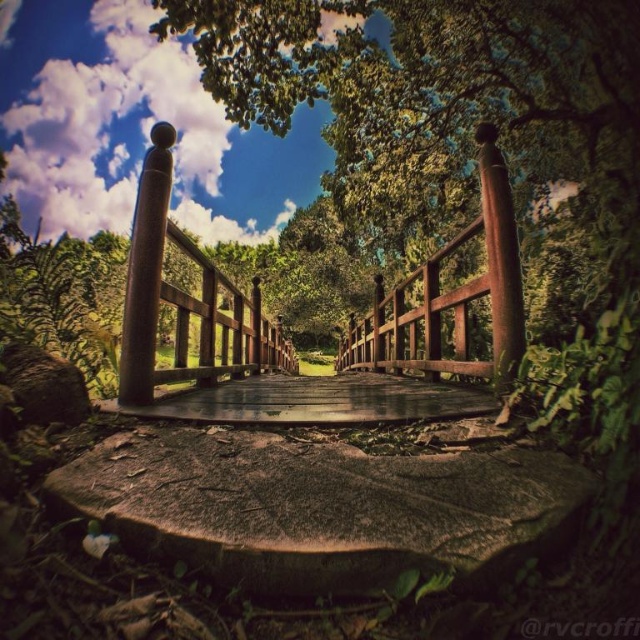
Between wooden bridge at center and smooth reddish-brown wooden post at center-right, which one appears on the left side from the viewer's perspective?

From the viewer's perspective, wooden bridge at center appears more on the left side.

Does point (396, 400) come farther from viewer compared to point (502, 177)?

Yes, it is behind point (502, 177).

Who is more forward, (250,401) or (488,221)?

Point (488,221)

The image size is (640, 640). I want to click on wooden bridge at center, so click(x=312, y=401).

Is brown rough stone at lower center shorter than rustic wood bridge at center?

Indeed, brown rough stone at lower center has a lesser height compared to rustic wood bridge at center.

Does point (214, 458) come behind point (269, 342)?

No, it is not.

Does point (323, 529) lie in front of point (172, 227)?

Yes, point (323, 529) is in front of point (172, 227).

Locate an element on the screen. The image size is (640, 640). brown rough stone at lower center is located at coordinates (323, 506).

Is brown rough stone at lower center positioned in front of smooth reddish-brown wooden post at center-right?

Yes, brown rough stone at lower center is closer to the viewer.

Does brown rough stone at lower center appear under smooth reddish-brown wooden post at center-right?

Correct, brown rough stone at lower center is located below smooth reddish-brown wooden post at center-right.

Which is in front, point (428, 547) or point (512, 298)?

Point (428, 547)

Where is `brown rough stone at lower center`? Image resolution: width=640 pixels, height=640 pixels. brown rough stone at lower center is located at coordinates (323, 506).